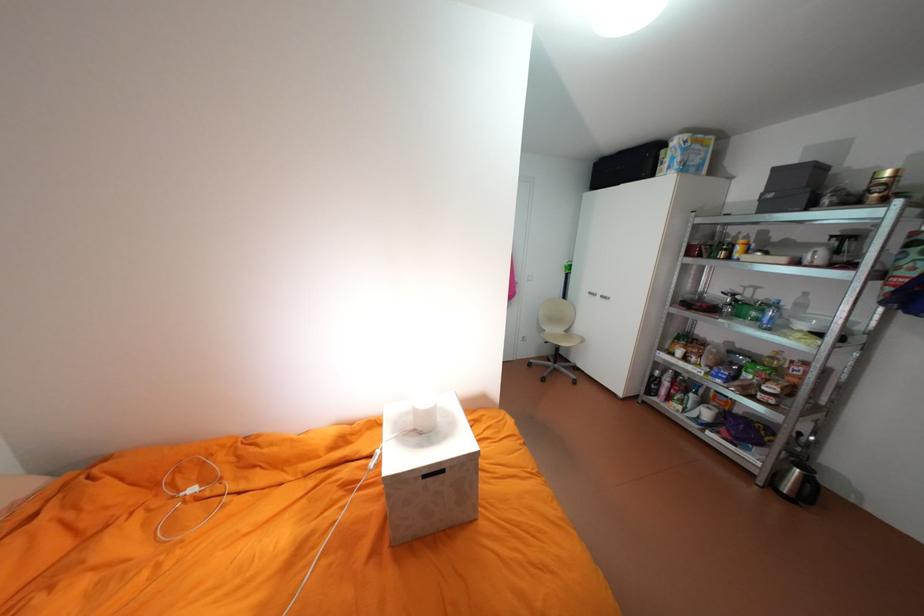
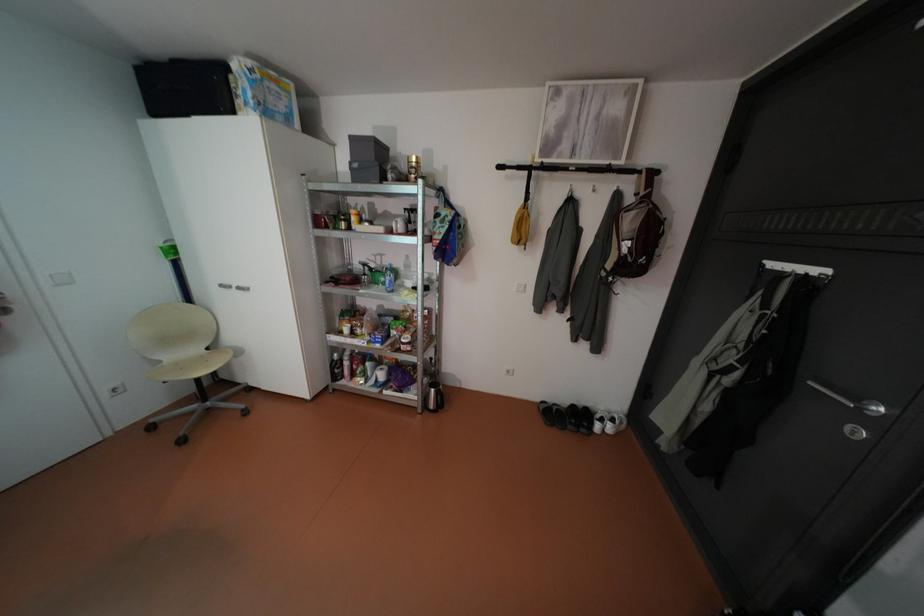
Find the pixel in the second image that matches the point at 747,314 in the first image.

(383, 282)